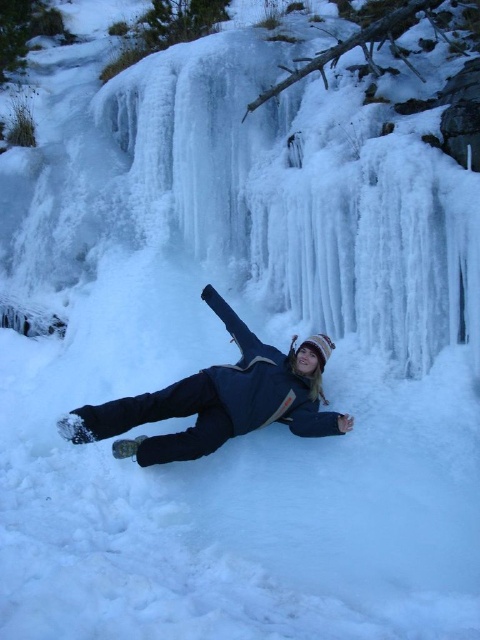
What are the coordinates of the icy translucent waterfall at upper center?

The icy translucent waterfall at upper center is located at point (x=303, y=196).

You are a photographer trying to capture the icy translucent waterfall at upper center and the blue fabric person at center in the same frame. Based on their positions, which object should you focus on first to ensure both are in focus?

The icy translucent waterfall at upper center is located above the blue fabric person at center, so you should focus on the icy translucent waterfall at upper center first to ensure both are in focus.